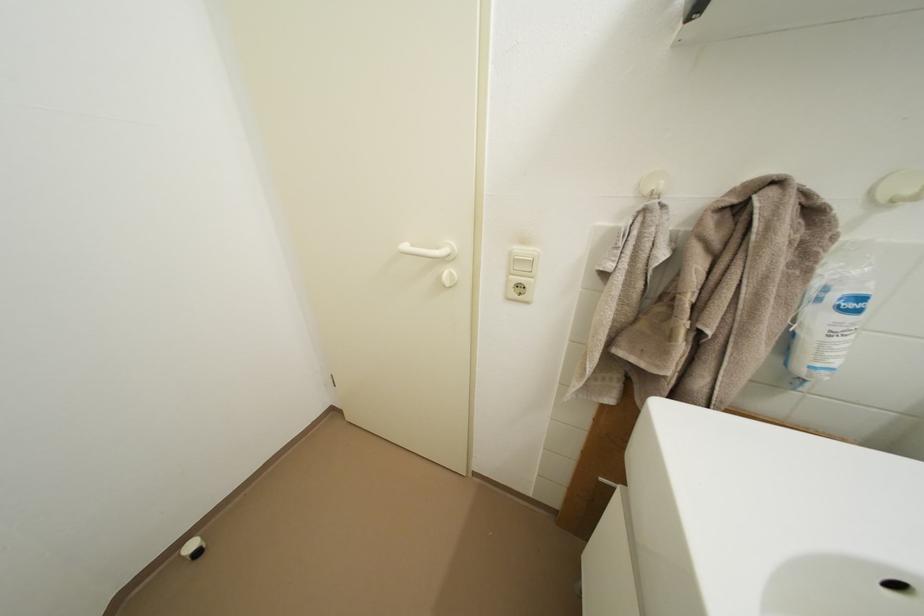
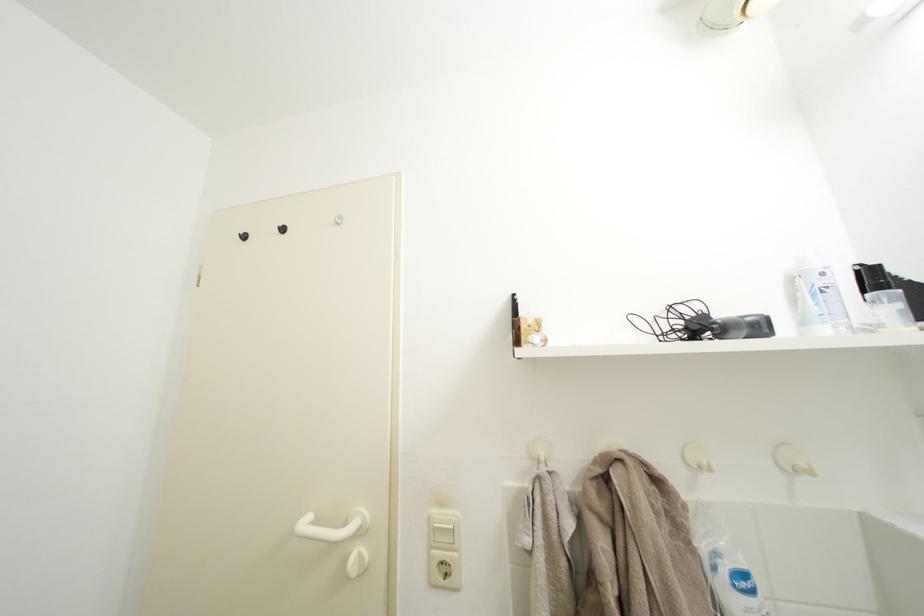
The point at (448, 282) is marked in the first image. Where is the corresponding point in the second image?

(354, 565)